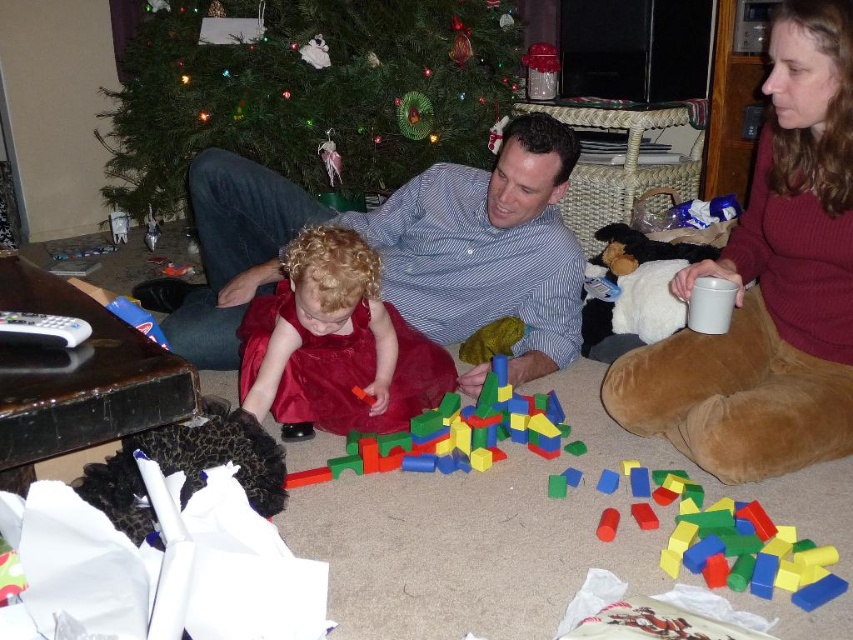
Question: Is green matte christmas tree at upper center wider than wooden blocks at center?

Choices:
 (A) yes
 (B) no

Answer: (A)

Question: Which point is closer to the camera?

Choices:
 (A) green matte christmas tree at upper center
 (B) blue striped shirt at center

Answer: (B)

Question: Which of the following is the closest to the observer?

Choices:
 (A) green matte christmas tree at upper center
 (B) wooden blocks at center

Answer: (B)

Question: Is smooth wooden blocks at center further to camera compared to green matte christmas tree at upper center?

Choices:
 (A) no
 (B) yes

Answer: (A)

Question: Estimate the real-world distances between objects in this image. Which object is closer to the blue striped shirt at center?

Choices:
 (A) velvet red dress at center
 (B) smooth wooden blocks at center

Answer: (A)

Question: Does green matte christmas tree at upper center appear over rubberized plastic blocks at center?

Choices:
 (A) no
 (B) yes

Answer: (B)